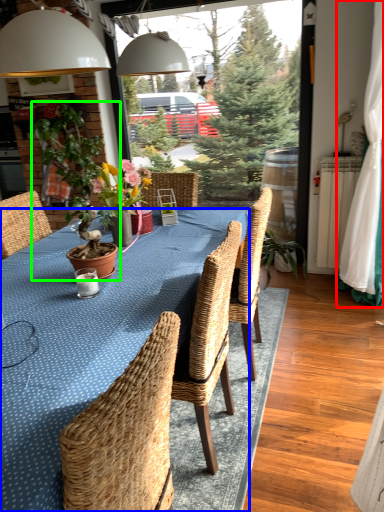
Question: Considering the real-world distances, which object is farthest from curtain (highlighted by a red box)? kitchen & dining room table (highlighted by a blue box) or houseplant (highlighted by a green box)?

Choices:
 (A) kitchen & dining room table
 (B) houseplant

Answer: (B)